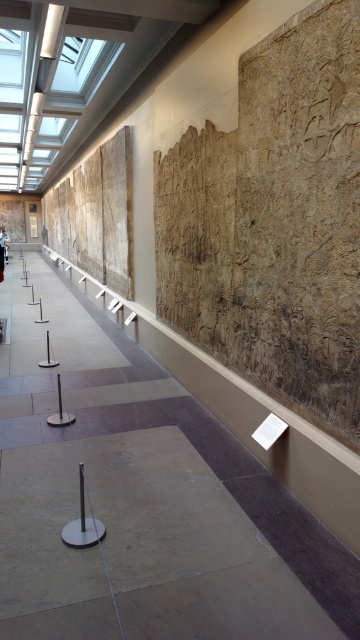
Question: Is silver/metallic pole at center behind white cotton shirt at center?

Choices:
 (A) no
 (B) yes

Answer: (A)

Question: Which point is farther from the camera taking this photo?

Choices:
 (A) (79, 500)
 (B) (1, 230)

Answer: (B)

Question: Does silver/metallic pole at center appear over white cotton shirt at center?

Choices:
 (A) no
 (B) yes

Answer: (A)

Question: Which of the following is the farthest from the observer?

Choices:
 (A) white cotton shirt at center
 (B) silver/metallic pole at center

Answer: (A)

Question: Is silver/metallic pole at center behind white cotton shirt at center?

Choices:
 (A) no
 (B) yes

Answer: (A)